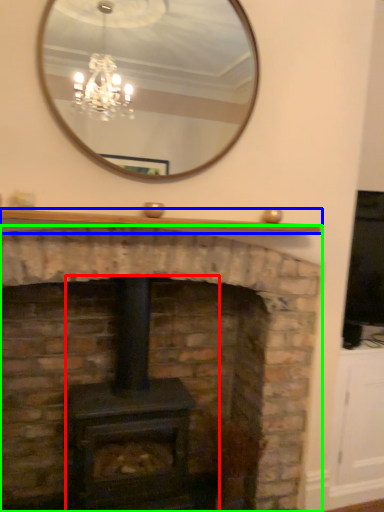
Question: Estimate the real-world distances between objects in this image. Which object is closer to wood burning stove (highlighted by a red box), mantle (highlighted by a blue box) or fireplace (highlighted by a green box)?

Choices:
 (A) mantle
 (B) fireplace

Answer: (B)